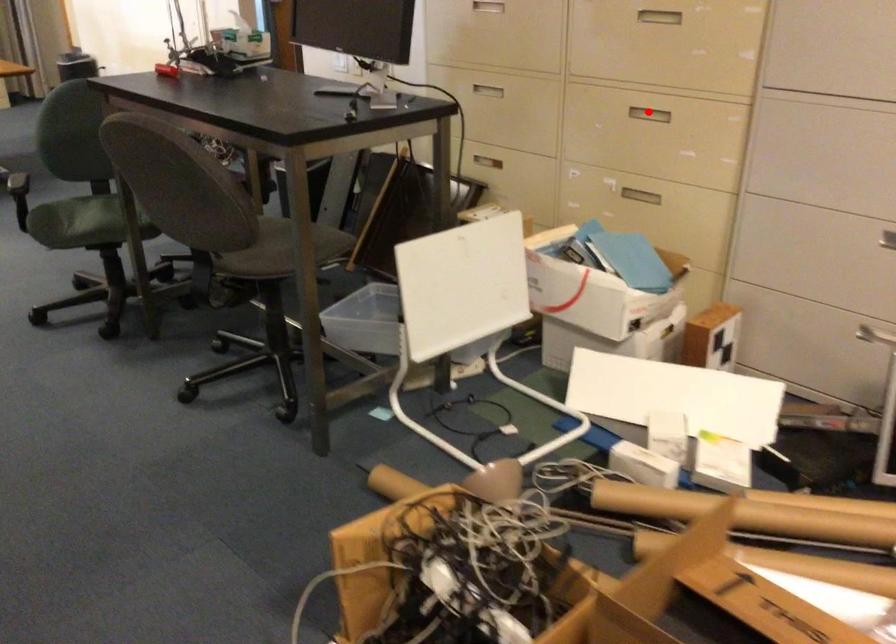
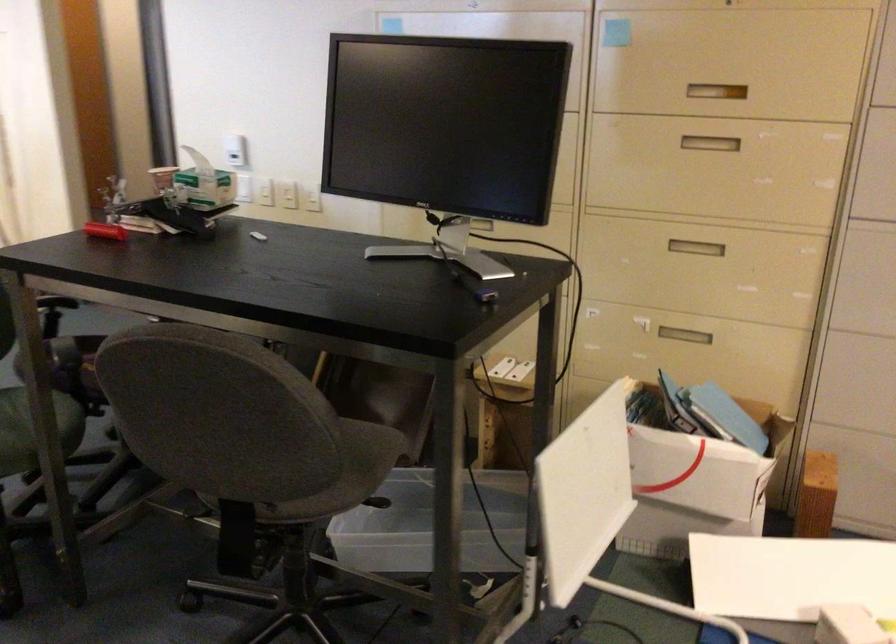
Question: I am providing you with two images of the same scene from different viewpoints. In image1, a red point is highlighted. Considering the same 3D point in image2, which of the following is correct?

Choices:
 (A) It is closer
 (B) It is farther

Answer: (A)